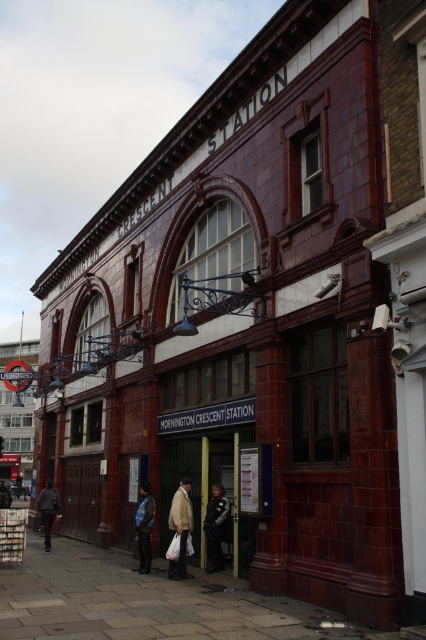
You are standing at the entrance of MORNINGTON CRESCENT STATION and want to take a photo of the iconic London Underground logo sign located at point (169,570). Your camera has a maximum focus range of 100 feet. Will you be able to focus on the sign?

The distance of point (169,570) from camera is 104.38 feet, which exceeds the camera maximum focus range of 100 feet. Therefore, the camera cannot focus on the sign.

You are a tailor who needs to determine which jacket requires more fabric for alterations. Based on the image, which jacket between the light beige jacket at center and the dark blue jacket at center would need more fabric?

The dark blue jacket at center requires more fabric because its width is greater than the light beige jacket at center.

You are a commuter at MORNINGTON CRESCENT STATION and you see both the light beige jacket at center and the dark blue jacket at center. Which jacket is covering the other one?

The light beige jacket at center is positioned over dark blue jacket at center, so it is covering the dark blue jacket at center.